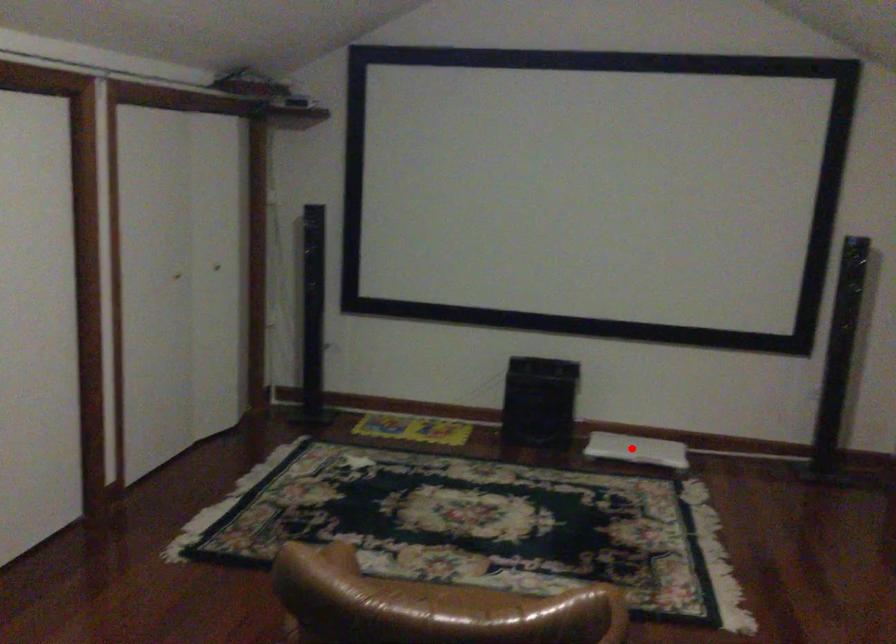
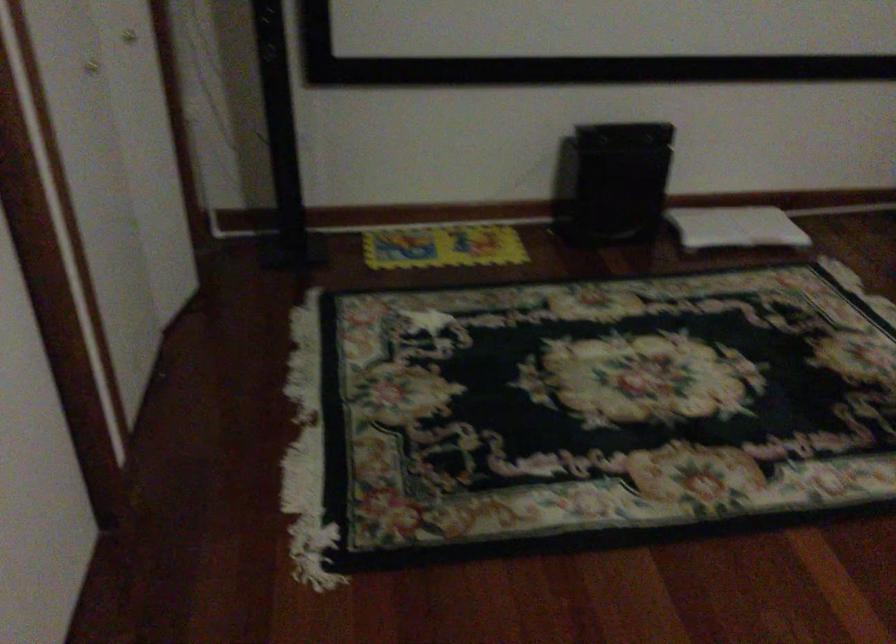
Where in the second image is the point corresponding to the highlighted location from the first image?

(735, 227)